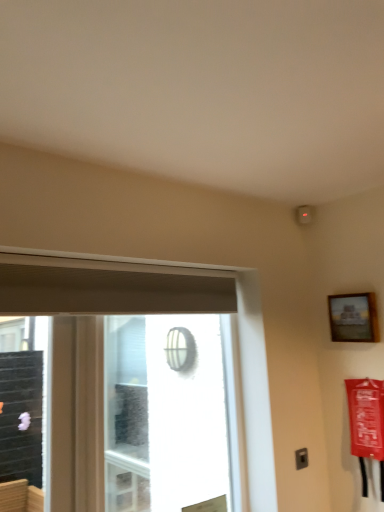
Question: Does white mesh screen at center lie in front of wooden frame at upper right?

Choices:
 (A) no
 (B) yes

Answer: (B)

Question: Is white mesh screen at center not within wooden frame at upper right?

Choices:
 (A) yes
 (B) no

Answer: (A)

Question: Is white mesh screen at center surrounding wooden frame at upper right?

Choices:
 (A) yes
 (B) no

Answer: (B)

Question: Does white mesh screen at center have a lesser width compared to wooden frame at upper right?

Choices:
 (A) yes
 (B) no

Answer: (B)

Question: Can you confirm if white mesh screen at center is bigger than wooden frame at upper right?

Choices:
 (A) yes
 (B) no

Answer: (A)

Question: Is white mesh screen at center directly adjacent to wooden frame at upper right?

Choices:
 (A) no
 (B) yes

Answer: (A)

Question: Can we say wooden frame at upper right lies outside transparent glass window at center?

Choices:
 (A) no
 (B) yes

Answer: (B)

Question: Considering the relative sizes of wooden frame at upper right and transparent glass window at center in the image provided, is wooden frame at upper right taller than transparent glass window at center?

Choices:
 (A) yes
 (B) no

Answer: (B)

Question: Is wooden frame at upper right far from transparent glass window at center?

Choices:
 (A) yes
 (B) no

Answer: (B)

Question: Is the surface of wooden frame at upper right in direct contact with transparent glass window at center?

Choices:
 (A) no
 (B) yes

Answer: (A)

Question: From a real-world perspective, is wooden frame at upper right positioned over transparent glass window at center based on gravity?

Choices:
 (A) no
 (B) yes

Answer: (B)

Question: Considering the relative sizes of wooden frame at upper right and transparent glass window at center in the image provided, is wooden frame at upper right thinner than transparent glass window at center?

Choices:
 (A) yes
 (B) no

Answer: (A)

Question: From the image's perspective, is white mesh screen at center below transparent glass window at center?

Choices:
 (A) no
 (B) yes

Answer: (A)